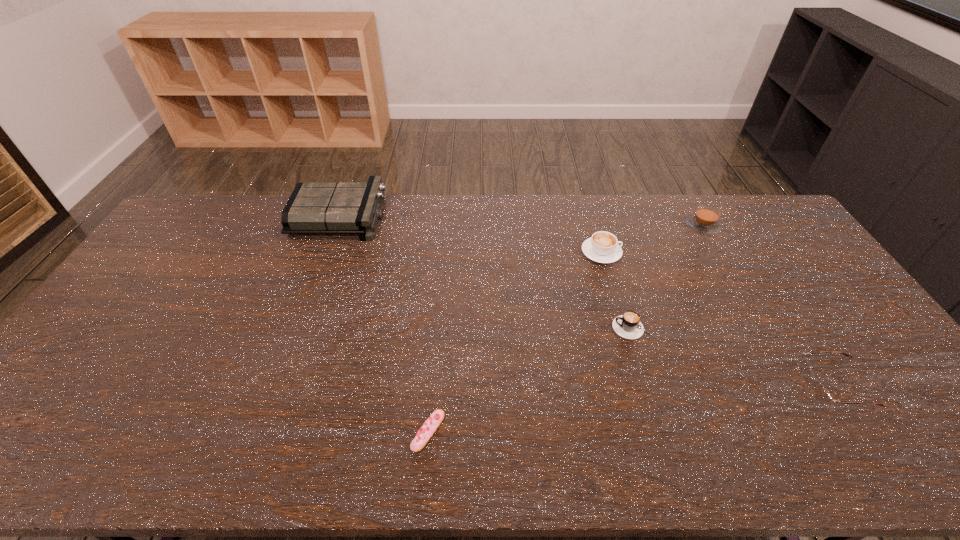
You are a GUI agent. You are given a task and a screenshot of the screen. Output one action in this format:
    pyautogui.click(x=<x>, y=<y>)
    Task: Click on the radio receiver
    
    Given the screenshot: What is the action you would take?
    pyautogui.click(x=313, y=208)

Find the location of a particular element. the leftmost object is located at coordinates (313, 208).

At what (x,y) coordinates should I click in order to perform the action: click on the rightmost cappuccino. Please return your answer as a coordinate pair (x, y). The width and height of the screenshot is (960, 540). Looking at the image, I should click on (705, 220).

Find the location of a particular element. The width and height of the screenshot is (960, 540). the second farthest cappuccino is located at coordinates (602, 247).

Locate an element on the screen. Image resolution: width=960 pixels, height=540 pixels. the nearest cappuccino is located at coordinates (628, 325).

Locate an element on the screen. The image size is (960, 540). spectacles is located at coordinates click(x=819, y=392).

Identify the location of the fifth object from right to left. (430, 426).

This screenshot has height=540, width=960. Find the location of `eclair`. eclair is located at coordinates (430, 426).

Find the location of a particular element. This screenshot has width=960, height=540. blank space located 0.050m on the front panel of the leftmost object is located at coordinates (397, 217).

Where is `free space located on the right of the farthest cappuccino`? free space located on the right of the farthest cappuccino is located at coordinates (784, 226).